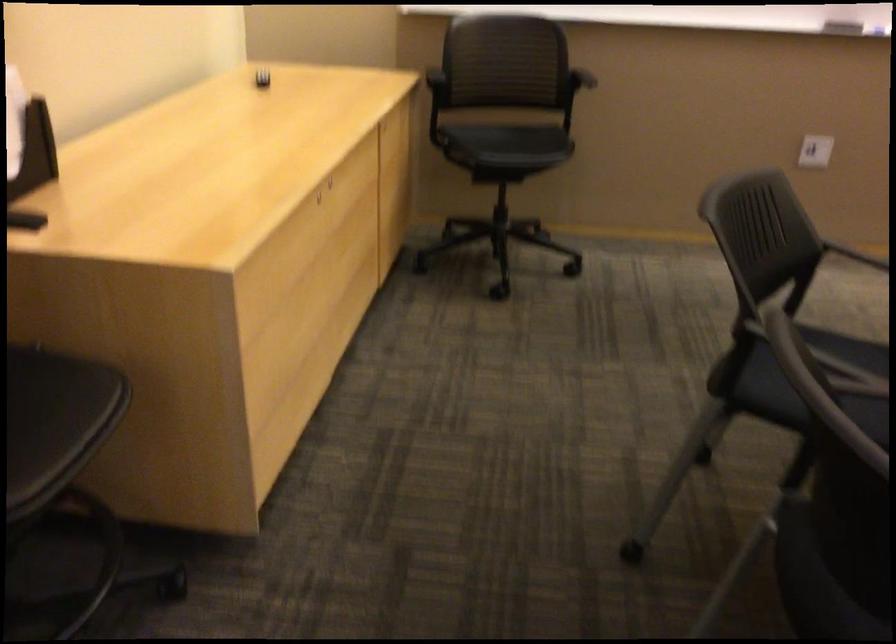
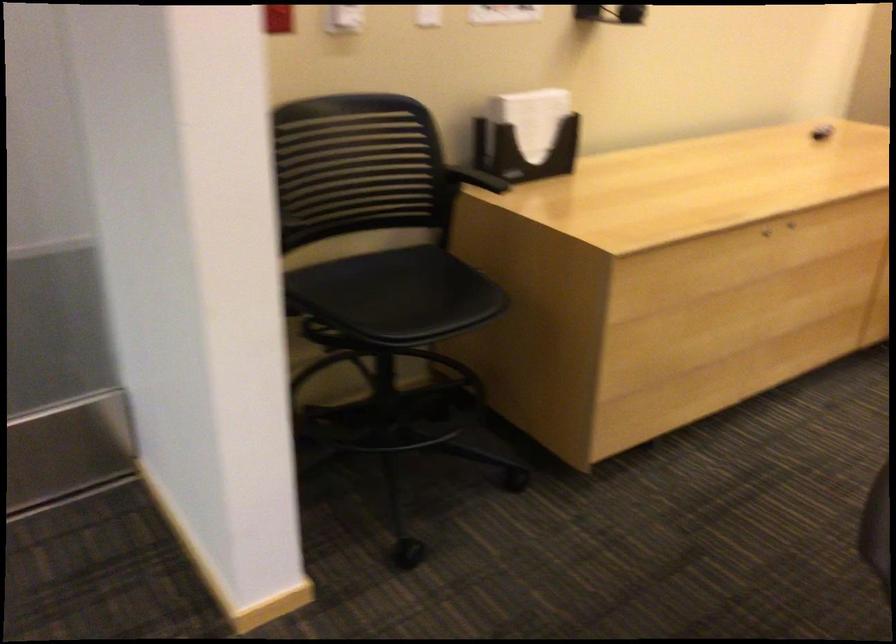
Locate, in the second image, the point that corresponds to point 331,204 in the first image.

(765, 232)